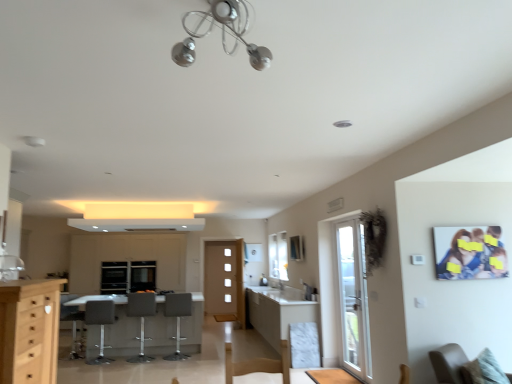
The width and height of the screenshot is (512, 384). Describe the element at coordinates (72, 321) in the screenshot. I see `gray fabric armchair at lower left, which appears as the fourth armchair when viewed from the right` at that location.

What do you see at coordinates (354, 297) in the screenshot? The image size is (512, 384). I see `white glass door at right` at bounding box center [354, 297].

What do you see at coordinates (177, 318) in the screenshot?
I see `matte gray bar stool at center, acting as the fourth armchair starting from the left` at bounding box center [177, 318].

I want to click on white glossy exhaust hood at upper center, so click(137, 224).

Consider the image. Between gray fabric armchair at lower left, which appears as the fourth armchair when viewed from the right, and white glossy exhaust hood at upper center, which one has smaller width?

gray fabric armchair at lower left, which appears as the fourth armchair when viewed from the right.

Could you tell me if gray fabric armchair at lower left, arranged as the 1th armchair when viewed from the left, is facing white glossy exhaust hood at upper center?

No, gray fabric armchair at lower left, arranged as the 1th armchair when viewed from the left, is not turned towards white glossy exhaust hood at upper center.

Is gray fabric armchair at lower left, which appears as the fourth armchair when viewed from the right, next to white glossy exhaust hood at upper center?

They are not placed beside each other.

Which of these two, gray fabric armchair at lower left, which appears as the fourth armchair when viewed from the right, or white glossy exhaust hood at upper center, stands taller?

Standing taller between the two is gray fabric armchair at lower left, which appears as the fourth armchair when viewed from the right.

How many degrees apart are the facing directions of white glossy table at center, acting as the second table starting from the front, and white glass door at right?

white glossy table at center, acting as the second table starting from the front, and white glass door at right are facing 90.4 degrees away from each other.

From the image's perspective, which one is positioned lower, white glossy table at center, the 1th table in the back-to-front sequence, or white glass door at right?

white glossy table at center, the 1th table in the back-to-front sequence, from the image's perspective.

Can you see white glossy table at center, the 1th table in the back-to-front sequence, touching white glass door at right?

white glossy table at center, the 1th table in the back-to-front sequence, is not next to white glass door at right, and they're not touching.

Is the depth of white glossy table at center, the 1th table in the top-to-bottom sequence, less than that of white glass door at right?

No, white glossy table at center, the 1th table in the top-to-bottom sequence, is further to the viewer.

Does white glossy table at center, the 1th table in the top-to-bottom sequence, have a greater width compared to light wood cabinet at left, the 1th cabinetry viewed from the front?

Yes.

Does point (196, 333) come in front of point (12, 345)?

No.

From the image's perspective, is white glossy table at center, the 1th table in the top-to-bottom sequence, beneath light wood cabinet at left, marked as the 3th cabinetry in a back-to-front arrangement?

Yes, from the image's perspective, white glossy table at center, the 1th table in the top-to-bottom sequence, is below light wood cabinet at left, marked as the 3th cabinetry in a back-to-front arrangement.

From the picture: Is light wood cabinet at left, the second cabinetry from the left, bigger than matte white cabinetry at center, which is the first cabinetry from back to front?

Incorrect, light wood cabinet at left, the second cabinetry from the left, is not larger than matte white cabinetry at center, which is the first cabinetry from back to front.

Which is in front, point (3, 319) or point (170, 280)?

The point (3, 319) is closer.

Are light wood cabinet at left, marked as the 3th cabinetry in a back-to-front arrangement, and matte white cabinetry at center, which ranks as the third cabinetry in front-to-back order, located far from each other?

Indeed, light wood cabinet at left, marked as the 3th cabinetry in a back-to-front arrangement, is not near matte white cabinetry at center, which ranks as the third cabinetry in front-to-back order.

Looking at this image, can you tell me how much gray fabric bar stool at lower left, marked as the third armchair in a right-to-left arrangement, and metallic chrome chandelier at upper center differ in facing direction?

The angle between the facing direction of gray fabric bar stool at lower left, marked as the third armchair in a right-to-left arrangement, and the facing direction of metallic chrome chandelier at upper center is 87.7 degrees.

From a real-world perspective, is gray fabric bar stool at lower left, marked as the third armchair in a right-to-left arrangement, under metallic chrome chandelier at upper center?

Indeed, from a real-world perspective, gray fabric bar stool at lower left, marked as the third armchair in a right-to-left arrangement, is positioned beneath metallic chrome chandelier at upper center.

From the image's perspective, which one is positioned higher, gray fabric bar stool at lower left, which appears as the second armchair when viewed from the left, or metallic chrome chandelier at upper center?

metallic chrome chandelier at upper center, from the image's perspective.

Could you measure the distance between gray fabric bar stool at lower left, which appears as the second armchair when viewed from the left, and metallic chrome chandelier at upper center?

gray fabric bar stool at lower left, which appears as the second armchair when viewed from the left, is 14.84 feet from metallic chrome chandelier at upper center.

Is metallic chrome chandelier at upper center in contact with light wood cabinet at left, marked as the 3th cabinetry in a back-to-front arrangement?

No, metallic chrome chandelier at upper center is not with light wood cabinet at left, marked as the 3th cabinetry in a back-to-front arrangement.

Is metallic chrome chandelier at upper center further to camera compared to light wood cabinet at left, marked as the 3th cabinetry in a back-to-front arrangement?

No.

From a real-world perspective, who is located higher, metallic chrome chandelier at upper center or light wood cabinet at left, the second cabinetry from the left?

In real-world perspective, metallic chrome chandelier at upper center is above.

Find the location of a particular element. Image resolution: width=512 pixels, height=384 pixels. the 1st cabinetry below when counting from the metallic chrome chandelier at upper center (from the image's perspective) is located at coordinates (29, 330).

Does white glossy exhaust hood at upper center turn towards beige fabric chair at lower right?

No, white glossy exhaust hood at upper center does not turn towards beige fabric chair at lower right.

Is white glossy exhaust hood at upper center completely or partially outside of beige fabric chair at lower right?

Absolutely, white glossy exhaust hood at upper center is external to beige fabric chair at lower right.

Are white glossy exhaust hood at upper center and beige fabric chair at lower right beside each other?

No, white glossy exhaust hood at upper center is not making contact with beige fabric chair at lower right.

Does point (106, 227) lie behind point (450, 347)?

Yes, point (106, 227) is farther from viewer.

Where is `the 3rd armchair below the white glossy exhaust hood at upper center (from a real-world perspective)`? the 3rd armchair below the white glossy exhaust hood at upper center (from a real-world perspective) is located at coordinates (72, 321).

Where is `door above the white glossy table at center, the 1th table in the top-to-bottom sequence (from a real-world perspective)`? This screenshot has width=512, height=384. door above the white glossy table at center, the 1th table in the top-to-bottom sequence (from a real-world perspective) is located at coordinates (354, 297).

Estimate the real-world distances between objects in this image. Which object is closer to matte gray bar stool at center, which is the first armchair in right-to-left order, white glass door at right or metallic chrome chandelier at upper center?

white glass door at right is positioned closer to the anchor matte gray bar stool at center, which is the first armchair in right-to-left order.

Which object lies further to the anchor point white marble cabinet at center, marked as the 2th cabinetry in a front-to-back arrangement, metallic chrome chandelier at upper center or grey fabric bar stool at center, positioned as the 3th armchair in left-to-right order?

Based on the image, metallic chrome chandelier at upper center appears to be further to white marble cabinet at center, marked as the 2th cabinetry in a front-to-back arrangement.

Based on their spatial positions, is white glossy table at center, which appears as the 1th table when viewed from the left, or matte photo frame at upper right closer to white glossy exhaust hood at upper center?

The object closer to white glossy exhaust hood at upper center is white glossy table at center, which appears as the 1th table when viewed from the left.

Based on their spatial positions, is matte gray bar stool at center, which is the first armchair in right-to-left order, or grey fabric bar stool at center, positioned as the 3th armchair in left-to-right order, further from gray fabric armchair at lower left, arranged as the 1th armchair when viewed from the left?

matte gray bar stool at center, which is the first armchair in right-to-left order, lies further to gray fabric armchair at lower left, arranged as the 1th armchair when viewed from the left, than the other object.

Looking at the image, which one is located further to grey fabric bar stool at center, the 2th armchair viewed from the right, brown wooden table at lower right, the 1th table positioned from the right, or gray fabric armchair at lower left, arranged as the 1th armchair when viewed from the left?

The object further to grey fabric bar stool at center, the 2th armchair viewed from the right, is brown wooden table at lower right, the 1th table positioned from the right.

When comparing their distances from metallic chrome chandelier at upper center, does grey fabric bar stool at center, positioned as the 3th armchair in left-to-right order, or matte white cabinetry at center, positioned as the third cabinetry in right-to-left order, seem closer?

Among the two, grey fabric bar stool at center, positioned as the 3th armchair in left-to-right order, is located nearer to metallic chrome chandelier at upper center.

Looking at the image, which one is located further to grey fabric bar stool at center, positioned as the 3th armchair in left-to-right order, matte white cabinetry at center, which ranks as the third cabinetry in front-to-back order, or light wood cabinet at left, marked as the 3th cabinetry in a back-to-front arrangement?

Based on the image, light wood cabinet at left, marked as the 3th cabinetry in a back-to-front arrangement, appears to be further to grey fabric bar stool at center, positioned as the 3th armchair in left-to-right order.

From the image, which object appears to be nearer to white glass door at right, gray fabric bar stool at lower left, which appears as the second armchair when viewed from the left, or metallic chrome chandelier at upper center?

gray fabric bar stool at lower left, which appears as the second armchair when viewed from the left, lies closer to white glass door at right than the other object.

This screenshot has width=512, height=384. Identify the location of chair between grey fabric bar stool at center, positioned as the 3th armchair in left-to-right order, and matte photo frame at upper right, in the horizontal direction. (450, 364).

Image resolution: width=512 pixels, height=384 pixels. Identify the location of couple between metallic chrome chandelier at upper center and matte white cabinetry at center, which ranks as the third cabinetry in front-to-back order, in the front-back direction. (470, 253).

Locate an element on the screen. table positioned between grey fabric bar stool at center, positioned as the 3th armchair in left-to-right order, and matte white cabinetry at center, the 1th cabinetry from the left, from near to far is located at coordinates (122, 332).

Locate an element on the screen. The height and width of the screenshot is (384, 512). table located between grey fabric bar stool at center, the 2th armchair viewed from the right, and matte photo frame at upper right in the left-right direction is located at coordinates (332, 377).